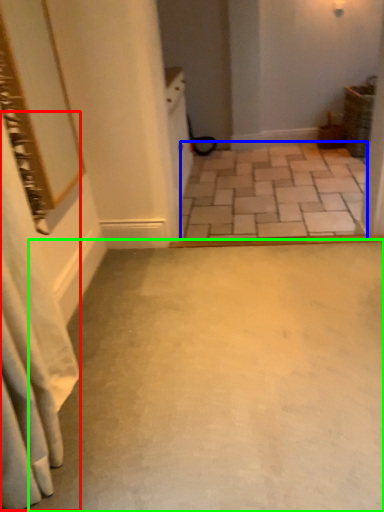
Question: Estimate the real-world distances between objects in this image. Which object is closer to shower curtain (highlighted by a red box), concrete (highlighted by a blue box) or concrete (highlighted by a green box)?

Choices:
 (A) concrete
 (B) concrete

Answer: (B)